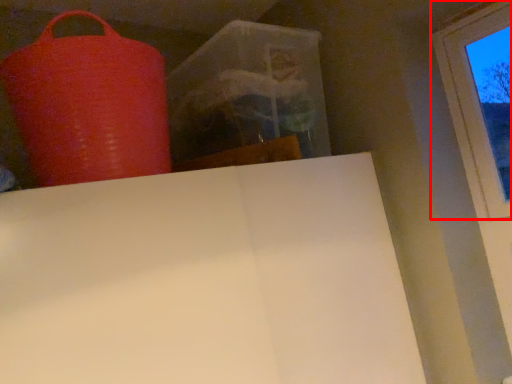
Question: In this image, where is window (annotated by the red box) located relative to punching bag?

Choices:
 (A) right
 (B) left

Answer: (A)